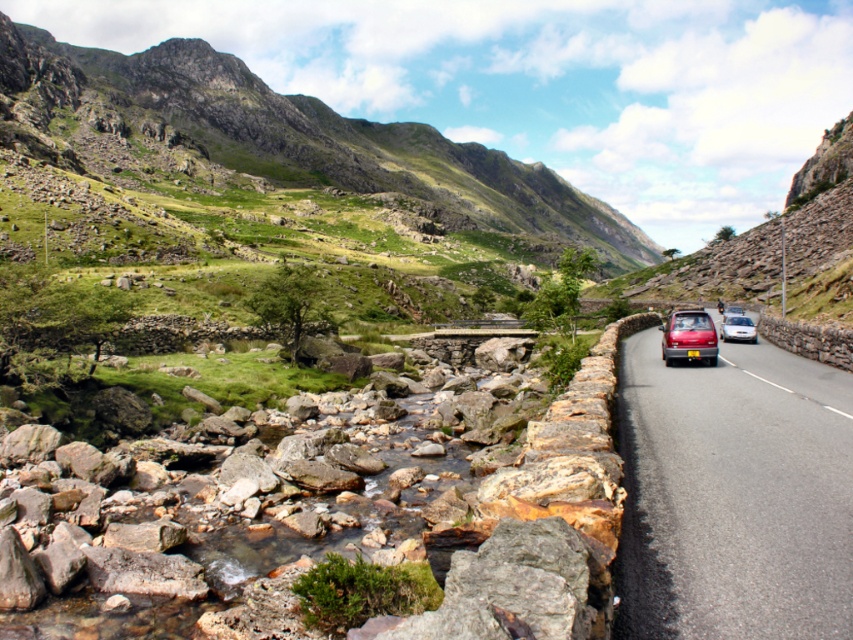
You are a driver in a shiny metallic car at right and want to park next to the matte red car at right. The parking space between them can accommodate a vehicle that is 15 feet long. Is there enough space for your car, which is 14.8 feet long?

The shiny metallic car at right is 20.32 feet away from the matte red car at right. Since the parking space is 20.32 feet and your car is only 14.8 feet long, there is sufficient space to park your car between them.

Looking at this image, you are a hiker standing at the stream bordered by the low stone wall. You want to take a photo of both the shiny metallic car at right and the satin silver sedan at right in the same frame. Which car should you position closer to the camera to ensure both are in focus?

To ensure both the shiny metallic car at right and the satin silver sedan at right are in focus, position the shiny metallic car at right closer to the camera since it is already nearer to the viewer compared to the satin silver sedan at right.

You are a photographer planning to capture both the shiny metallic car at right and the matte red car at right in a single shot. Given the mountainous terrain and the position of the cars, which car would appear closer to the camera in the final photograph?

The shiny metallic car at right is larger in size than the matte red car at right, so it would appear closer to the camera in the final photograph.